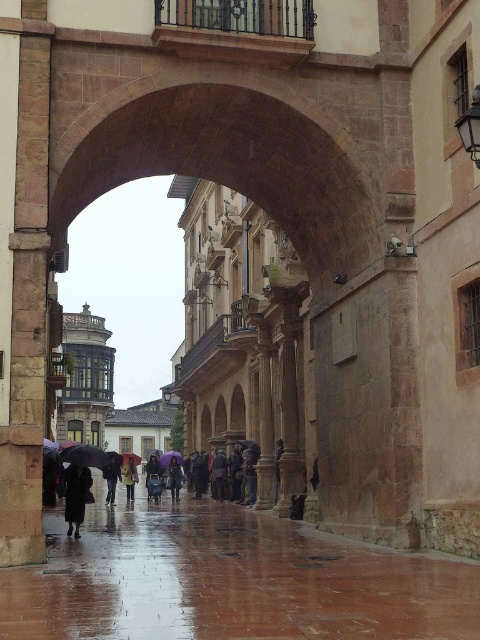
You are standing at the entrance of the historic street under the large stone archway. You see a blue fabric umbrella at center. Where is the blue fabric umbrella located relative to the archway?

The blue fabric umbrella at center is located at point 0.747 on the horizontal axis and 0.321 on the vertical axis relative to the archway.